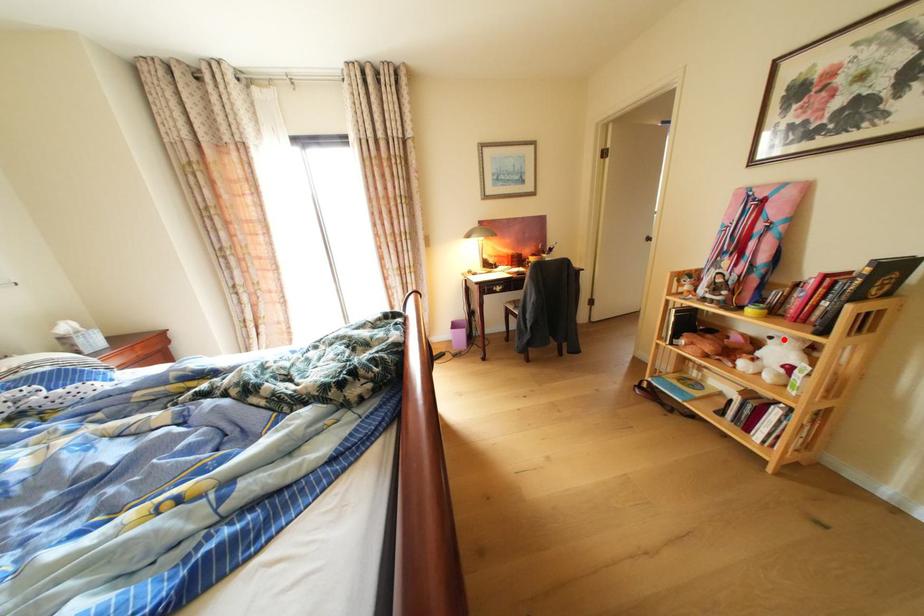
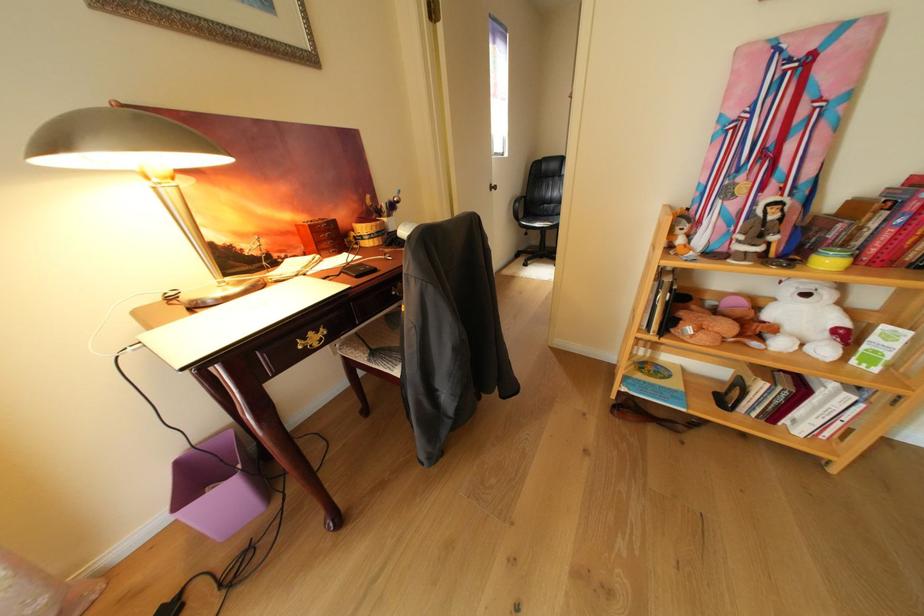
In the second image, find the point that corresponds to the highlighted location in the first image.

(820, 297)